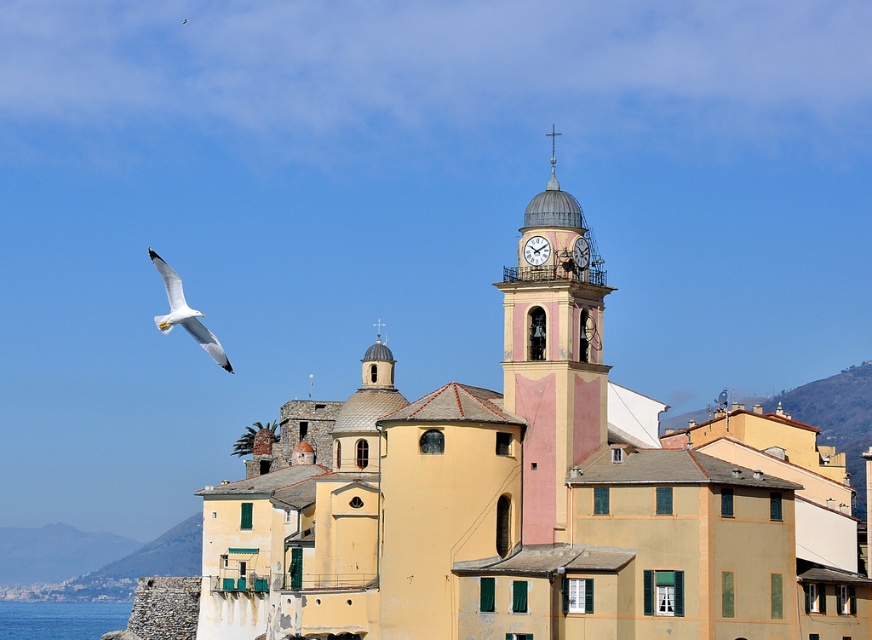
Question: Observing the image, what is the correct spatial positioning of beige stone buildings at lower left in reference to white glossy clock at upper center?

Choices:
 (A) below
 (B) above

Answer: (A)

Question: Can you confirm if beige stone buildings at lower left is positioned to the left of white glossy clock at upper center?

Choices:
 (A) yes
 (B) no

Answer: (A)

Question: Can you confirm if blue water at lower left is positioned to the left of white glossy clock at upper center?

Choices:
 (A) yes
 (B) no

Answer: (A)

Question: Which point appears farthest from the camera in this image?

Choices:
 (A) (723, 440)
 (B) (528, 440)

Answer: (A)

Question: Which of the following is the farthest from the observer?

Choices:
 (A) (181, 312)
 (B) (713, 589)
 (C) (583, 278)

Answer: (C)

Question: Estimate the real-world distances between objects in this image. Which object is farther from the pink painted stone clock tower at upper center?

Choices:
 (A) white glossy clock at upper center
 (B) white feathered bird at upper left

Answer: (B)